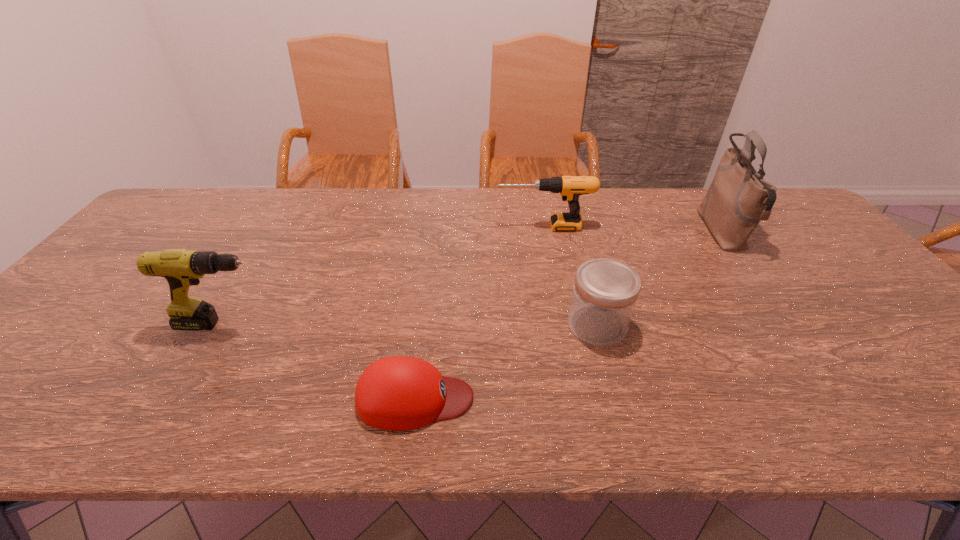
The width and height of the screenshot is (960, 540). What are the coordinates of `the tallest object` in the screenshot? It's located at coord(738,198).

This screenshot has width=960, height=540. In order to click on shoulder bag in this screenshot , I will do `click(738, 198)`.

Where is `the nearer drill`? The width and height of the screenshot is (960, 540). the nearer drill is located at coordinates pos(182,268).

Where is `the leftmost object`? The image size is (960, 540). the leftmost object is located at coordinates (182, 268).

Where is `the right drill`? The height and width of the screenshot is (540, 960). the right drill is located at coordinates (570, 188).

This screenshot has width=960, height=540. I want to click on the farther drill, so click(x=570, y=188).

You are a GUI agent. You are given a task and a screenshot of the screen. Output one action in this format:
    pyautogui.click(x=<x>, y=<y>)
    Task: Click on the jar
    The width and height of the screenshot is (960, 540).
    Given the screenshot: What is the action you would take?
    pyautogui.click(x=605, y=292)

The image size is (960, 540). What are the coordinates of `the nearest object` in the screenshot? It's located at (398, 393).

Where is `the shortest object`? This screenshot has width=960, height=540. the shortest object is located at coordinates (398, 393).

The image size is (960, 540). In order to click on blank space located on the front-facing side of the tallest object in this screenshot , I will do `click(684, 232)`.